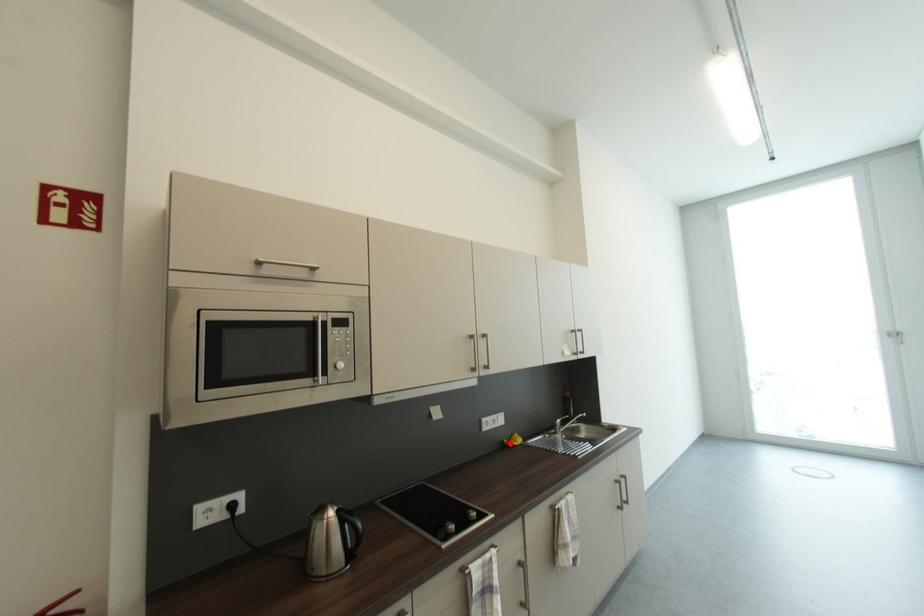
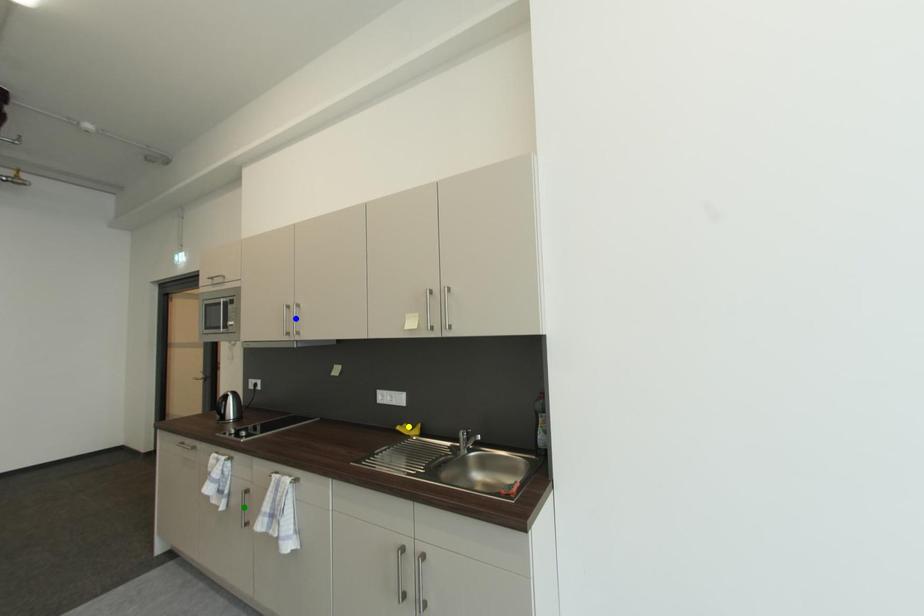
Question: I am providing you with two images of the same scene from different viewpoints. A red point is marked on the first image. You are given multiple points on the second image. Which point in image 2 represents the same 3d spot as the red point in image 1?

Choices:
 (A) green point
 (B) blue point
 (C) yellow point

Answer: (C)